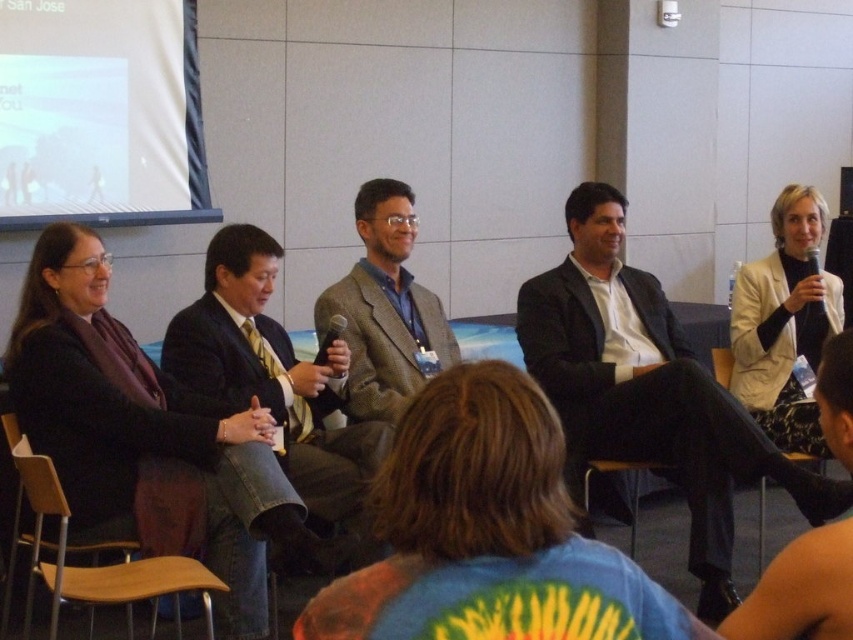
Which is in front, point (564, 278) or point (56, 168)?

Point (564, 278) is more forward.

Is point (724, 444) farther from camera compared to point (50, 192)?

No, (724, 444) is in front of (50, 192).

I want to click on matte black suit at right, so click(x=648, y=390).

The height and width of the screenshot is (640, 853). I want to click on matte black suit at right, so click(648, 390).

Can you confirm if matte black suit at right is smaller than wooden at right?

No, matte black suit at right is not smaller than wooden at right.

At what (x,y) coordinates should I click in order to perform the action: click on matte black suit at right. Please return your answer as a coordinate pair (x, y). Image resolution: width=853 pixels, height=640 pixels. Looking at the image, I should click on (648, 390).

Where is `matte black suit at right`? matte black suit at right is located at coordinates (648, 390).

Who is taller, textured brown blazer at center or wooden chair at lower left?

textured brown blazer at center is taller.

Is point (399, 253) farther from viewer compared to point (102, 579)?

Yes, it is behind point (102, 579).

Identify the location of textured brown blazer at center. (386, 308).